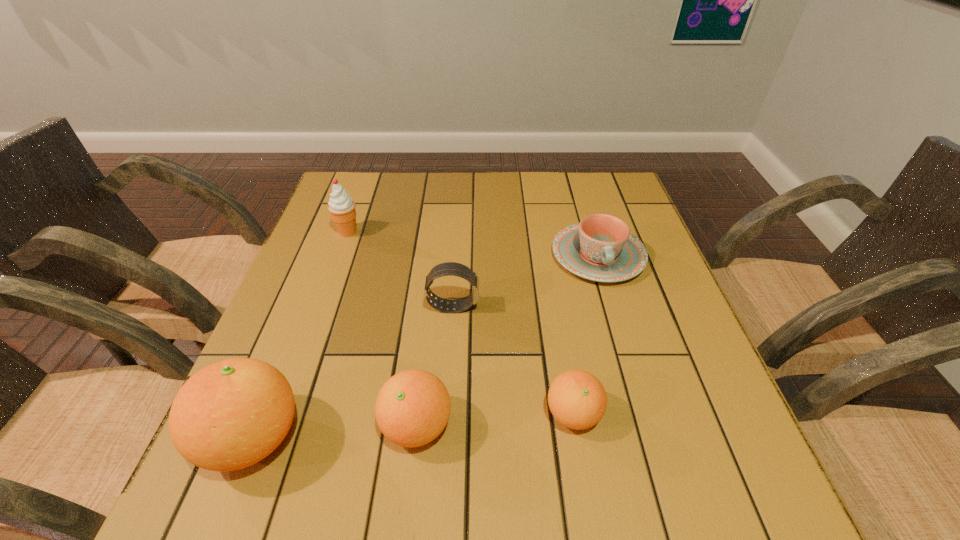
Where is `the tallest orange`? the tallest orange is located at coordinates (229, 415).

Locate an element on the screen. The image size is (960, 540). the second tallest orange is located at coordinates (412, 408).

The image size is (960, 540). What are the coordinates of `the rightmost orange` in the screenshot? It's located at (577, 399).

Where is `icecream`? icecream is located at coordinates (341, 206).

Locate an element on the screen. This screenshot has height=540, width=960. the third farthest object is located at coordinates (448, 268).

Locate an element on the screen. chinaware is located at coordinates (600, 248).

The height and width of the screenshot is (540, 960). In order to click on vacant space positioned on the back of the tallest orange in this screenshot , I will do `click(324, 258)`.

Identify the location of free region located 0.220m on the left of the second orange from right to left. Image resolution: width=960 pixels, height=540 pixels. (255, 426).

Locate an element on the screen. This screenshot has width=960, height=540. vacant region located 0.170m on the back of the shortest orange is located at coordinates tap(558, 321).

I want to click on free space located on the front of the icecream, so click(x=319, y=314).